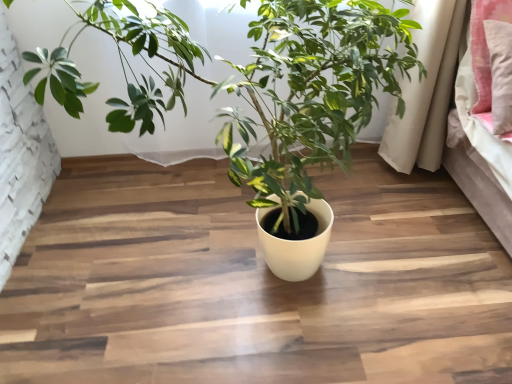
Question: From the image's perspective, is pink fabric pillow at upper right beneath yellow matte pot at center?

Choices:
 (A) yes
 (B) no

Answer: (B)

Question: Is the position of pink fabric pillow at upper right more distant than that of yellow matte pot at center?

Choices:
 (A) no
 (B) yes

Answer: (B)

Question: Is pink fabric pillow at upper right not near yellow matte pot at center?

Choices:
 (A) no
 (B) yes

Answer: (A)

Question: From the image's perspective, does pink fabric pillow at upper right appear higher than yellow matte pot at center?

Choices:
 (A) no
 (B) yes

Answer: (B)

Question: Is yellow matte pot at center surrounded by pink fabric pillow at upper right?

Choices:
 (A) no
 (B) yes

Answer: (A)

Question: Is pink fabric pillow at upper right shorter than yellow matte pot at center?

Choices:
 (A) yes
 (B) no

Answer: (A)

Question: Does yellow matte pot at center have a greater width compared to pink fabric pillow at upper right?

Choices:
 (A) no
 (B) yes

Answer: (B)

Question: Does yellow matte pot at center touch pink fabric pillow at upper right?

Choices:
 (A) no
 (B) yes

Answer: (A)

Question: Considering the relative positions of yellow matte pot at center and pink fabric pillow at upper right in the image provided, is yellow matte pot at center behind pink fabric pillow at upper right?

Choices:
 (A) no
 (B) yes

Answer: (A)

Question: Is yellow matte pot at center closer to the viewer compared to pink fabric pillow at upper right?

Choices:
 (A) no
 (B) yes

Answer: (B)

Question: Can you confirm if yellow matte pot at center is positioned to the right of pink fabric pillow at upper right?

Choices:
 (A) no
 (B) yes

Answer: (A)

Question: Can you confirm if yellow matte pot at center is shorter than pink fabric pillow at upper right?

Choices:
 (A) no
 (B) yes

Answer: (A)

Question: Considering the relative positions of pink fabric pillow at upper right and yellow matte pot at center in the image provided, is pink fabric pillow at upper right to the left or to the right of yellow matte pot at center?

Choices:
 (A) left
 (B) right

Answer: (B)